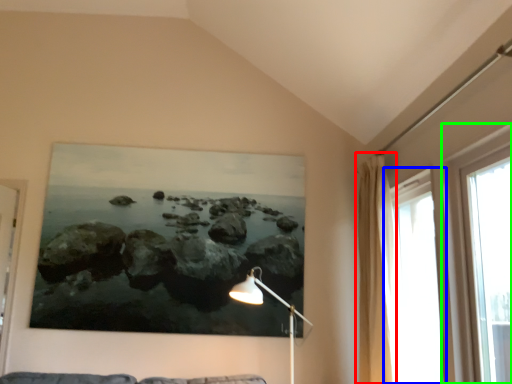
Question: Estimate the real-world distances between objects in this image. Which object is closer to curtain (highlighted by a red box), window (highlighted by a blue box) or window (highlighted by a green box)?

Choices:
 (A) window
 (B) window

Answer: (A)